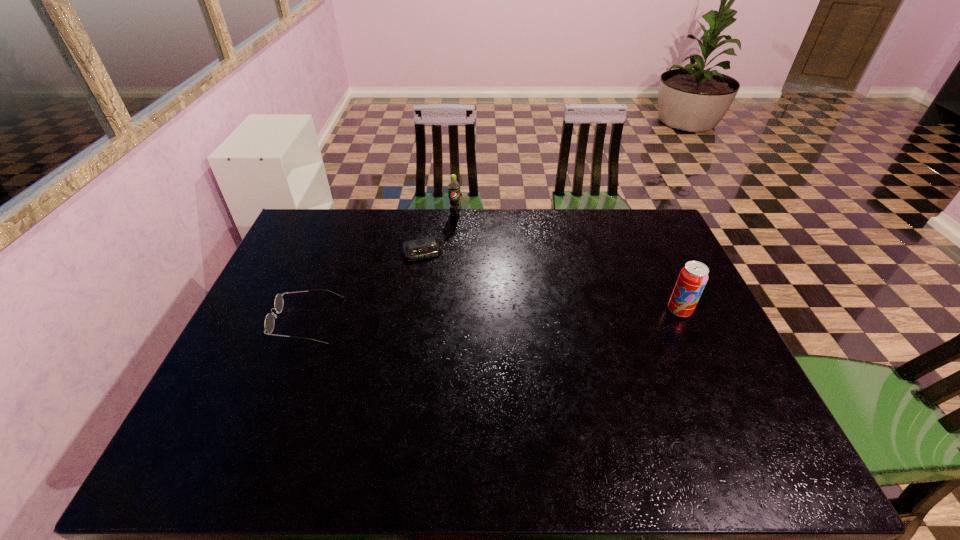
Locate an element on the screen. free space on the desktop that is between the third tallest object and the right soda and is positioned on the display of the second farthest object is located at coordinates (442, 316).

Find the location of a particular element. This screenshot has width=960, height=540. vacant space on the desktop that is between the leftmost object and the rightmost object and is positioned on the front label of the second object from right to left is located at coordinates (449, 316).